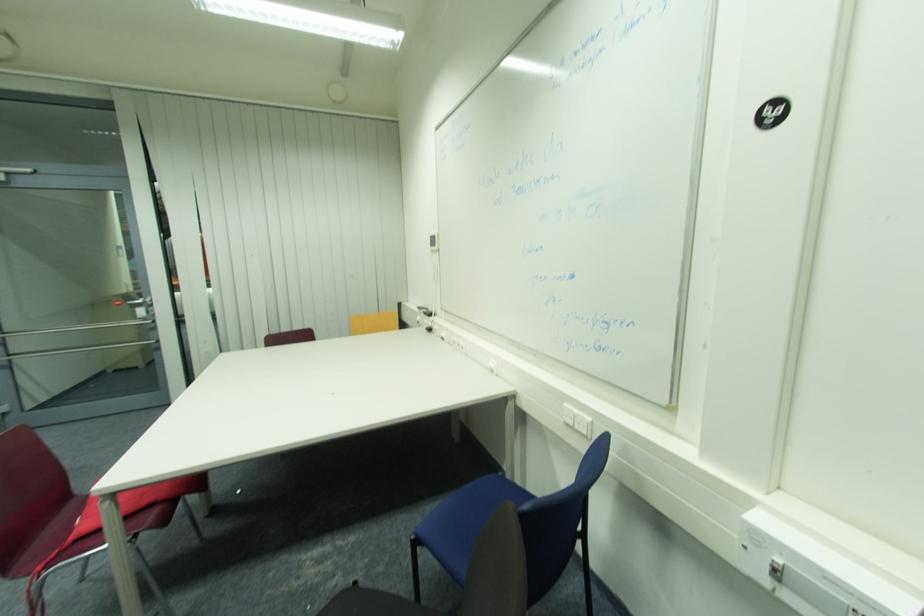
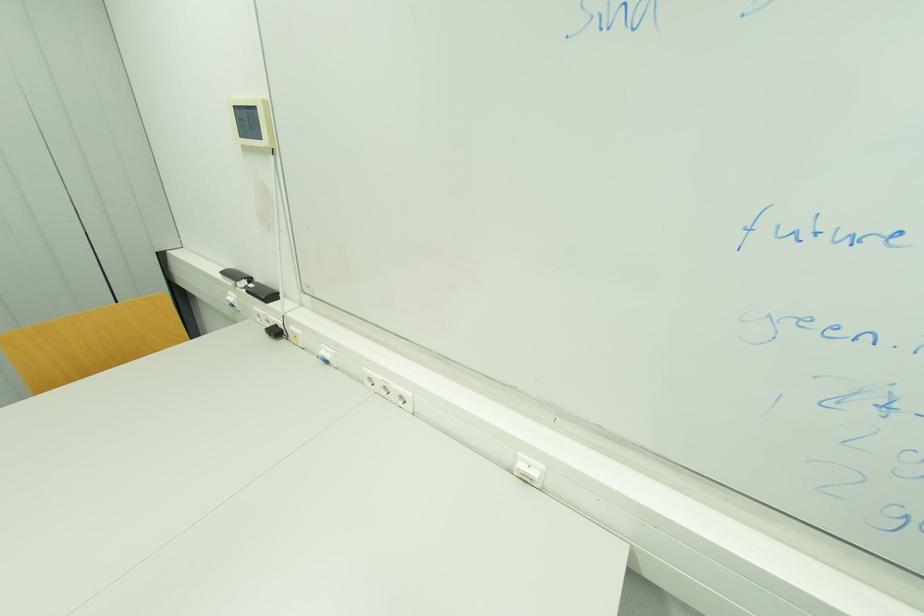
Locate, in the second image, the point that corresponds to (467,345) in the first image.

(409, 394)